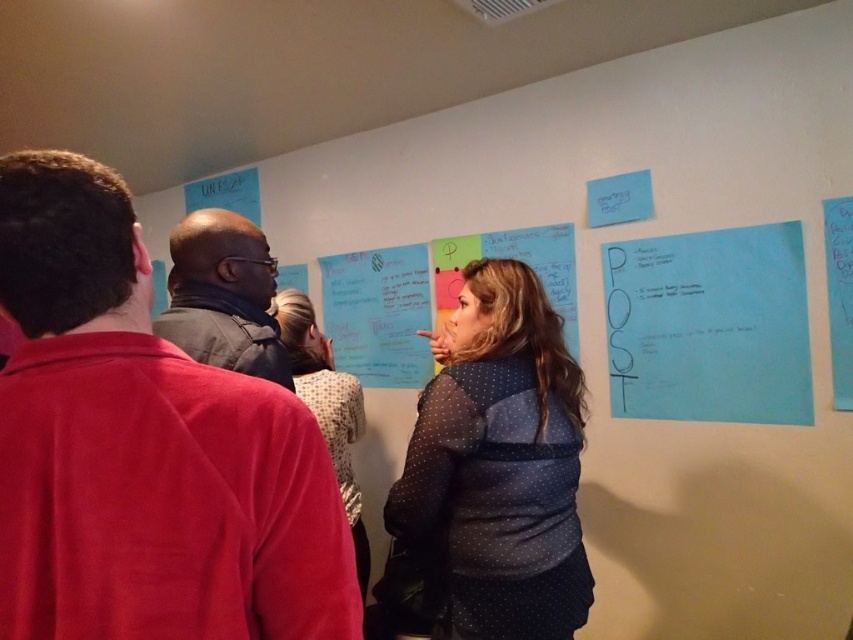
You are an observer in the room. You see two items at the center of the scene, the dark gray sweater at center and the polka dot fabric at center. Which one is more to the left?

The dark gray sweater at center is positioned on the left side of polka dot fabric at center, so it is more to the left.

In the scene, there are two people wearing red fabric shirt at left and dark gray sweater at center. Which one is positioned more to the left side?

The dark gray sweater at center is positioned more to the left side because the red fabric shirt at left is to the right of it.

You are part of the brainstorming group and need to reference both the polka dot fabric jacket at center and the dark gray sweater at center pinned on the wall. Which one is positioned to the right side of the other?

The polka dot fabric jacket at center is to the right of the dark gray sweater at center.